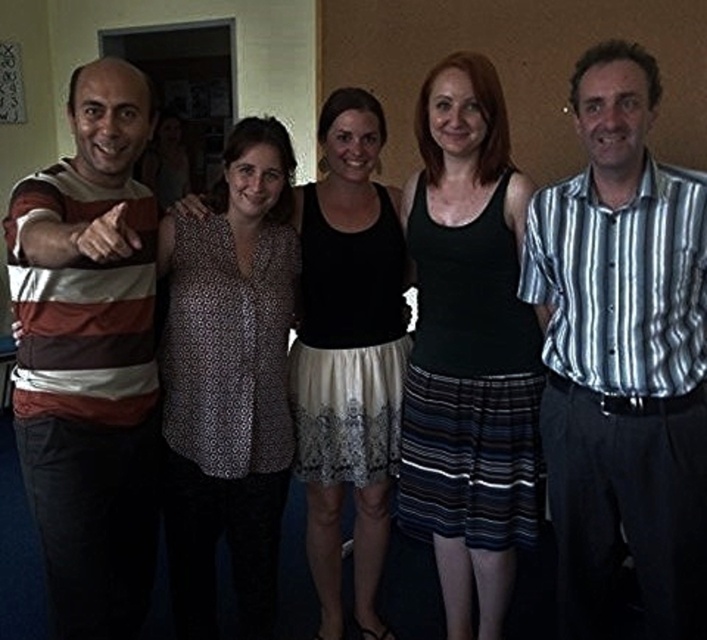
Question: Can you confirm if striped cotton shirt at right is positioned to the right of striped cotton shirt at left?

Choices:
 (A) no
 (B) yes

Answer: (B)

Question: From the image, what is the correct spatial relationship of black tank top at center in relation to patterned fabric blouse at center?

Choices:
 (A) above
 (B) below

Answer: (A)

Question: Based on their relative distances, which object is farther from the printed fabric blouse at center?

Choices:
 (A) black tank top at center
 (B) striped cotton shirt at right

Answer: (B)

Question: Which object appears farthest from the camera in this image?

Choices:
 (A) striped cotton shirt at left
 (B) black tank top at center

Answer: (B)

Question: Can you confirm if black tank top at center is positioned to the right of printed fabric blouse at center?

Choices:
 (A) yes
 (B) no

Answer: (A)

Question: Which point is farther to the camera?

Choices:
 (A) (226, 344)
 (B) (626, 497)
 (C) (356, 604)

Answer: (C)